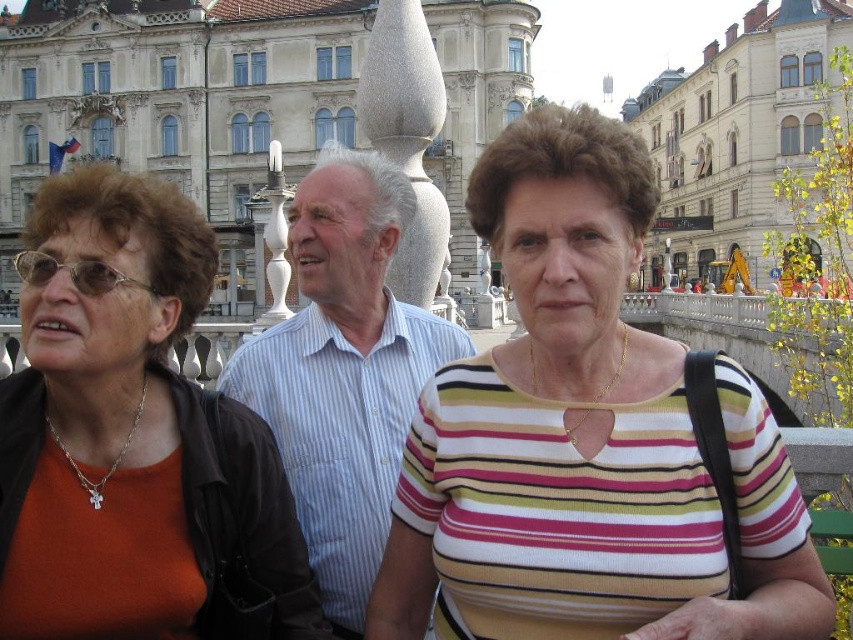
Measure the distance from striped knit top at center to white striped shirt at center.

striped knit top at center is 8.75 meters from white striped shirt at center.

Identify the location of striped knit top at center. (584, 438).

Where is `striped knit top at center`? striped knit top at center is located at coordinates (584, 438).

Between striped knit top at center and matte black jacket at left, which one has more height?

Standing taller between the two is striped knit top at center.

Identify the location of striped knit top at center. (x=584, y=438).

I want to click on striped knit top at center, so click(x=584, y=438).

Is point (128, 449) in front of point (338, 563)?

Yes, it is in front of point (338, 563).

Which is below, matte black jacket at left or white striped shirt at center?

Positioned lower is matte black jacket at left.

Who is more distant from viewer, (107, 282) or (361, 596)?

The point (361, 596) is behind.

You are a GUI agent. You are given a task and a screenshot of the screen. Output one action in this format:
    pyautogui.click(x=<x>, y=<y>)
    Task: Click on the matte black jacket at left
    The width and height of the screenshot is (853, 640).
    Given the screenshot: What is the action you would take?
    pyautogui.click(x=107, y=408)